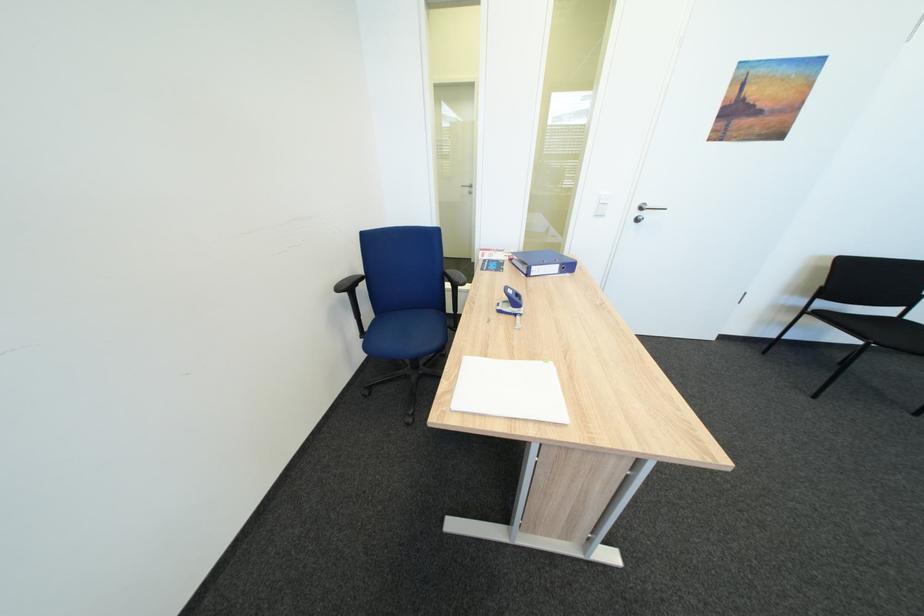
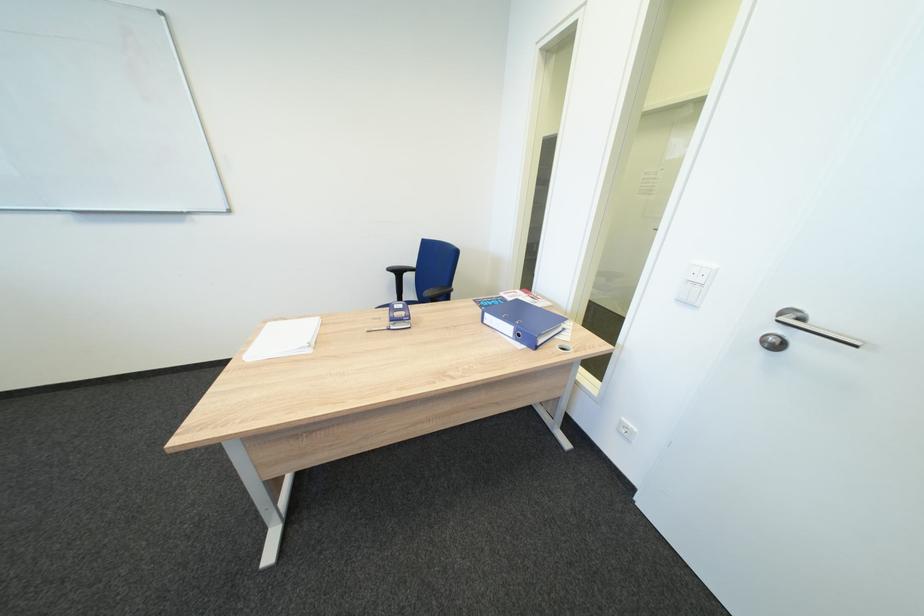
Where in the second image is the point corresponding to [648,222] from the first image?

(784, 346)